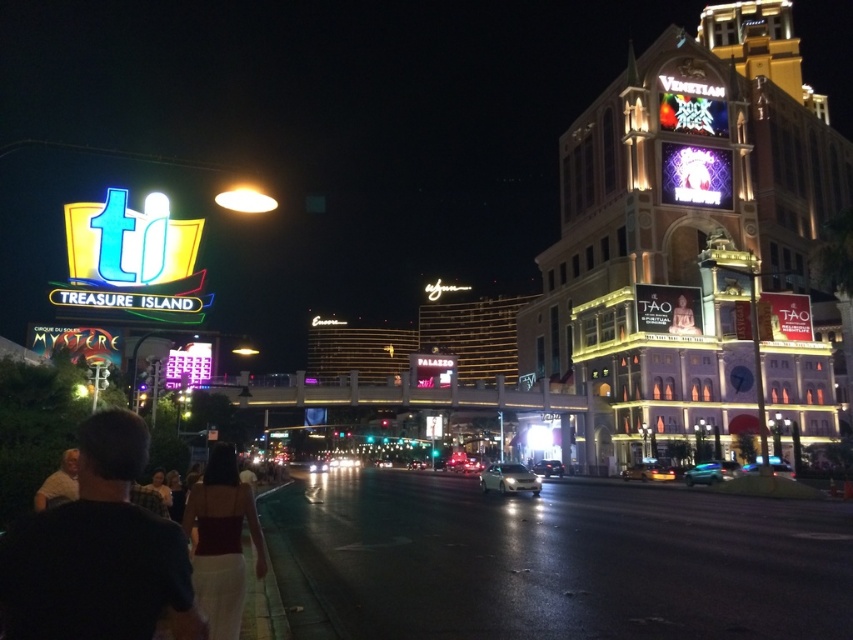
You are standing on the sidewalk in front of the Treasure Island hotel. You see two points marked on the ground ahead of you. The first point is at coordinates point (207, 524) and the second is at point (537, 486). Which point is closer to you?

Point (207, 524) is closer to the viewer than point (537, 486).

You are a photographer standing on the sidewalk in this scene. You want to take a photo of both the dark brown shirt at lower left and the light brown shirt at lower left. Which person should you focus on first to ensure both are in frame?

Answer: You should focus on the dark brown shirt at lower left first because it is taller than the light brown shirt at lower left, so adjusting the camera angle to include the taller person will naturally include the shorter one as well.

You are a photographer standing on the sidewalk in this scene. You want to take a photo of the brown fabric dress at lower left and the shiny silver sedan at center. Which object is positioned higher in the frame?

The brown fabric dress at lower left is located above the shiny silver sedan at center in the frame.